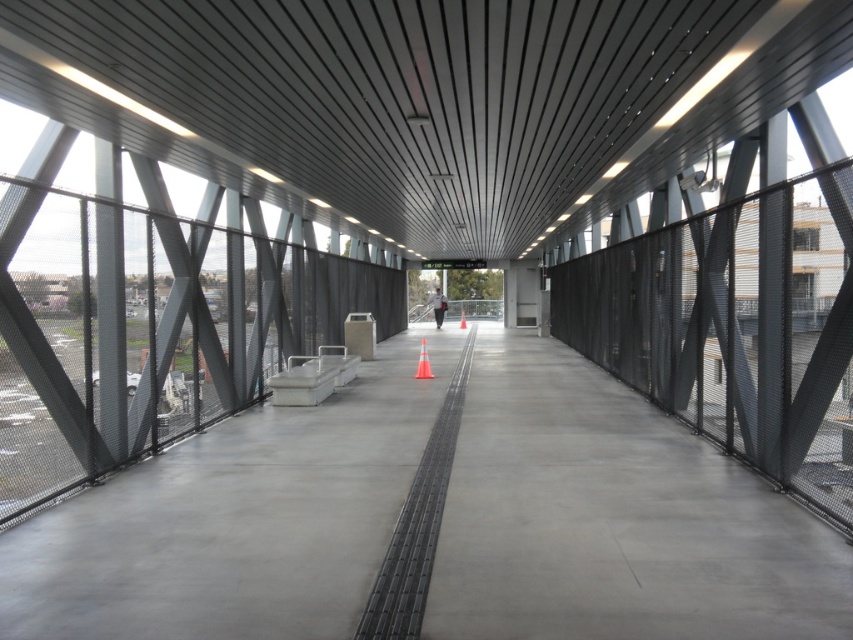
Question: Which point is farther to the camera?

Choices:
 (A) metallic gray overpass at center
 (B) concrete at center
 (C) orange reflective cone at center

Answer: (C)

Question: Is metallic gray overpass at center in front of orange reflective cone at center?

Choices:
 (A) no
 (B) yes

Answer: (B)

Question: Among these objects, which one is farthest from the camera?

Choices:
 (A) orange reflective cone at center
 (B) concrete at center
 (C) metallic gray overpass at center

Answer: (A)

Question: Does concrete at center have a smaller size compared to orange reflective cone at center?

Choices:
 (A) no
 (B) yes

Answer: (A)

Question: Which object is closer to the camera taking this photo?

Choices:
 (A) orange reflective cone at center
 (B) metallic gray overpass at center
 (C) concrete at center

Answer: (B)

Question: Considering the relative positions of metallic gray overpass at center and orange reflective cone at center in the image provided, where is metallic gray overpass at center located with respect to orange reflective cone at center?

Choices:
 (A) above
 (B) below

Answer: (A)